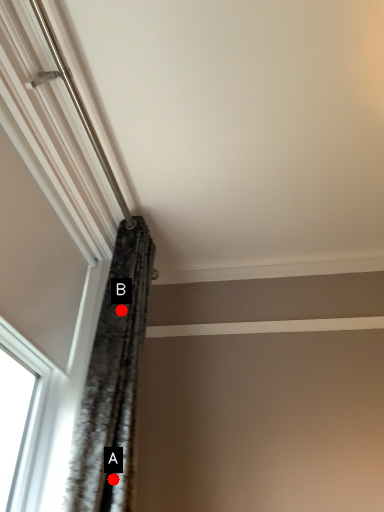
Question: Two points are circled on the image, labeled by A and B beside each circle. Which point is farther from the camera taking this photo?

Choices:
 (A) A is further
 (B) B is further

Answer: (B)